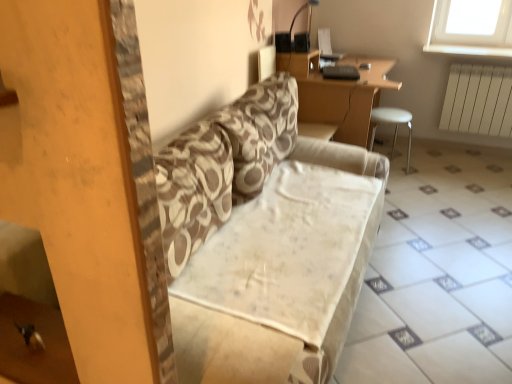
Locate an element on the screen. This screenshot has width=512, height=384. vacant area situated below white plastic radiator at right (from a real-world perspective) is located at coordinates (474, 151).